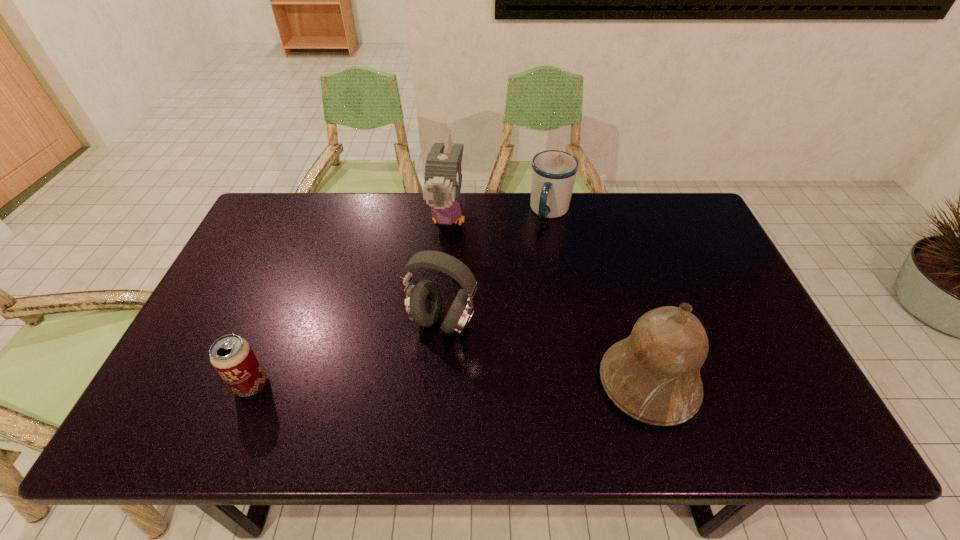
Identify the location of free space on the desktop that is between the beer can and the bell and is positioned on the ear cups of the headset. Image resolution: width=960 pixels, height=540 pixels. (404, 384).

Where is `vacant space on the desktop that is between the leftmost object and the bell and is positioned at the beak of the bird`? The image size is (960, 540). vacant space on the desktop that is between the leftmost object and the bell and is positioned at the beak of the bird is located at coordinates (408, 384).

Identify the location of free space on the desktop that is between the shortest object and the bell and is positioned on the handle side of the mug. (502, 383).